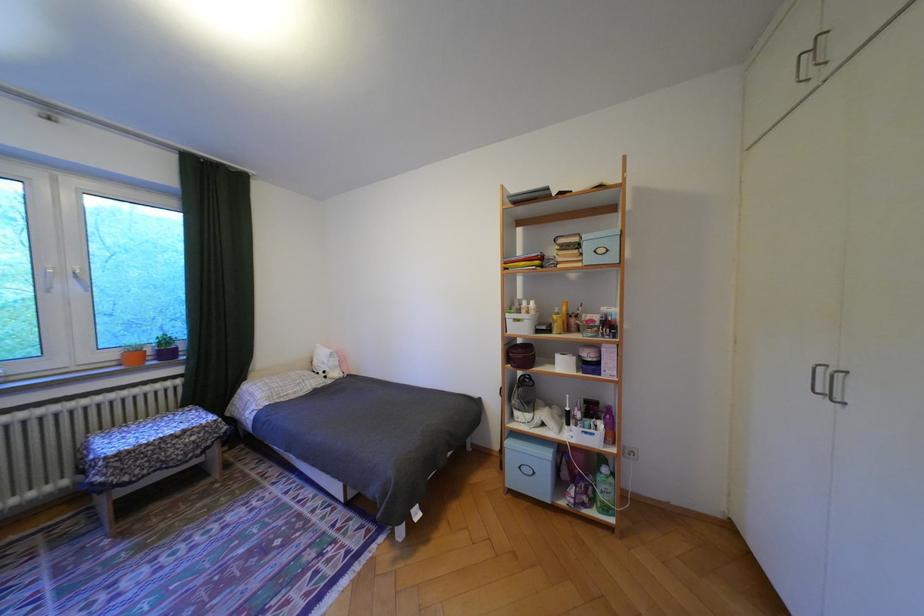
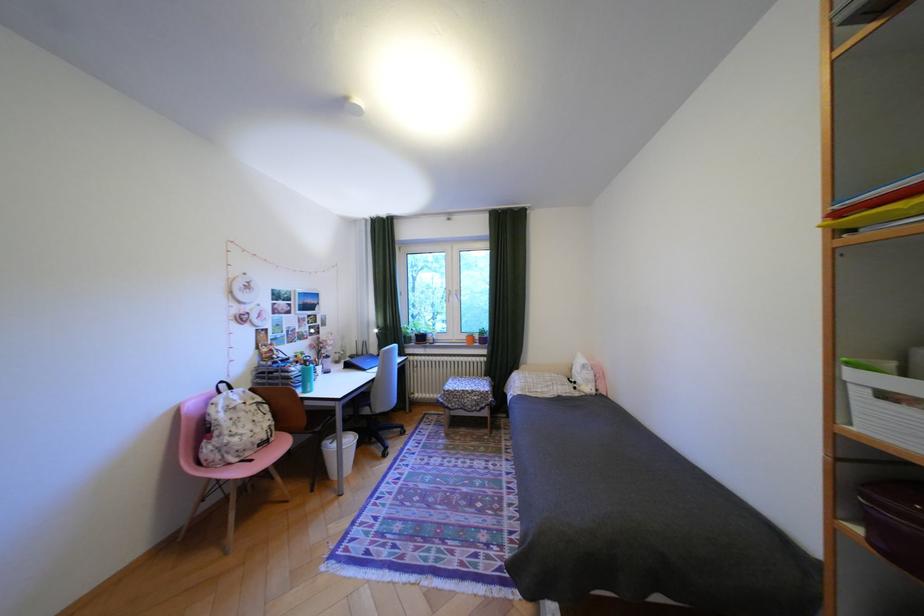
Question: The first image is from the beginning of the video and the second image is from the end. How did the camera likely rotate when shooting the video?

Choices:
 (A) Left
 (B) Right
 (C) Up
 (D) Down

Answer: (A)